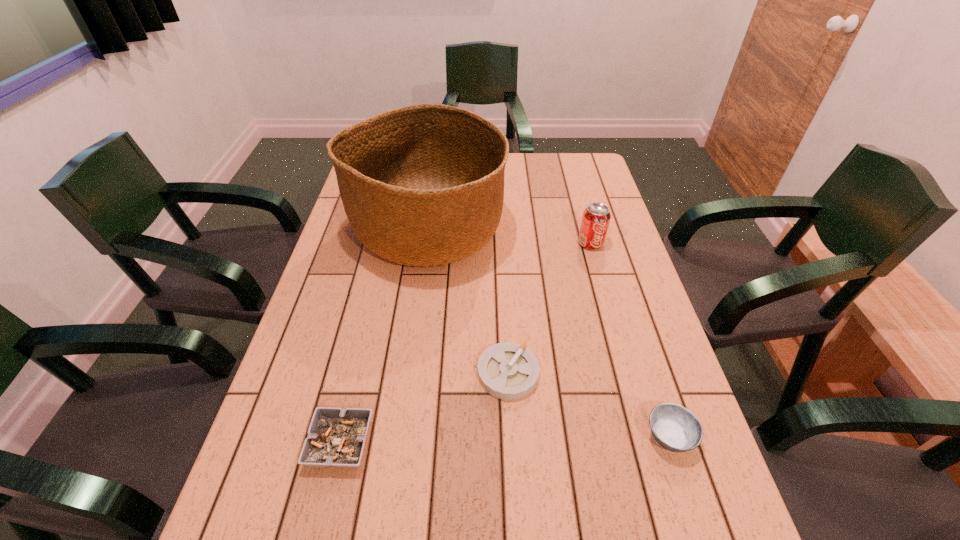
What are the coordinates of `the tallest object` in the screenshot? It's located at 422,185.

I want to click on soda can, so click(x=596, y=217).

This screenshot has width=960, height=540. I want to click on the tallest ashtray, so click(x=675, y=428).

Where is `the third tallest object`? This screenshot has width=960, height=540. the third tallest object is located at coordinates (675, 428).

Image resolution: width=960 pixels, height=540 pixels. What are the coordinates of `the farthest ashtray` in the screenshot? It's located at (509, 371).

The width and height of the screenshot is (960, 540). I want to click on the second ashtray from left to right, so click(509, 371).

You are a GUI agent. You are given a task and a screenshot of the screen. Output one action in this format:
    pyautogui.click(x=<x>, y=<y>)
    Task: Click on the leftmost ashtray
    The height and width of the screenshot is (540, 960).
    Given the screenshot: What is the action you would take?
    (x=336, y=437)

Find the location of a particular element. The image size is (960, 540). vacant space located on the right of the tallest object is located at coordinates coord(542,230).

At what (x,y) coordinates should I click in order to perform the action: click on free region located 0.260m on the left of the fourth shortest object. Please return your answer as a coordinate pair (x, y). The width and height of the screenshot is (960, 540). Looking at the image, I should click on (493, 244).

The image size is (960, 540). Identify the location of blank space located on the back of the tallest ashtray. (652, 381).